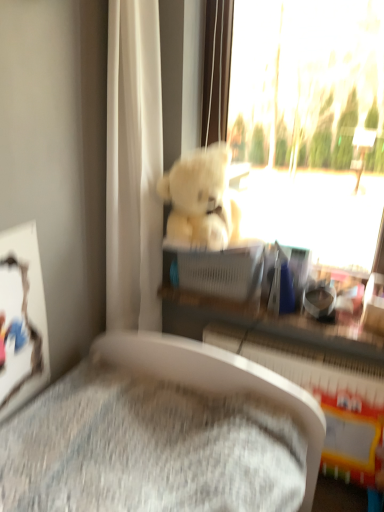
Question: Does white plush bear at upper center have a greater height compared to fluffy white teddy bear at upper center?

Choices:
 (A) yes
 (B) no

Answer: (A)

Question: Is white plush bear at upper center not close to fluffy white teddy bear at upper center?

Choices:
 (A) no
 (B) yes

Answer: (A)

Question: From a real-world perspective, is white plush bear at upper center physically below fluffy white teddy bear at upper center?

Choices:
 (A) no
 (B) yes

Answer: (A)

Question: Does white plush bear at upper center come in front of fluffy white teddy bear at upper center?

Choices:
 (A) yes
 (B) no

Answer: (A)

Question: Is white plush bear at upper center thinner than fluffy white teddy bear at upper center?

Choices:
 (A) yes
 (B) no

Answer: (A)

Question: Does white plush bear at upper center have a smaller size compared to fluffy white teddy bear at upper center?

Choices:
 (A) no
 (B) yes

Answer: (A)

Question: Does matte plastic shelf at center turn towards white plastic radiator at lower center?

Choices:
 (A) no
 (B) yes

Answer: (A)

Question: Considering the relative positions of matte plastic shelf at center and white plastic radiator at lower center in the image provided, is matte plastic shelf at center to the left of white plastic radiator at lower center from the viewer's perspective?

Choices:
 (A) no
 (B) yes

Answer: (B)

Question: Is matte plastic shelf at center directly adjacent to white plastic radiator at lower center?

Choices:
 (A) no
 (B) yes

Answer: (A)

Question: From a real-world perspective, is matte plastic shelf at center located higher than white plastic radiator at lower center?

Choices:
 (A) no
 (B) yes

Answer: (B)

Question: Considering the relative sizes of matte plastic shelf at center and white plastic radiator at lower center in the image provided, is matte plastic shelf at center bigger than white plastic radiator at lower center?

Choices:
 (A) yes
 (B) no

Answer: (B)

Question: Is matte plastic shelf at center wider than white plastic radiator at lower center?

Choices:
 (A) no
 (B) yes

Answer: (A)

Question: Is white plastic radiator at lower center in front of white plush bear at upper center?

Choices:
 (A) yes
 (B) no

Answer: (B)